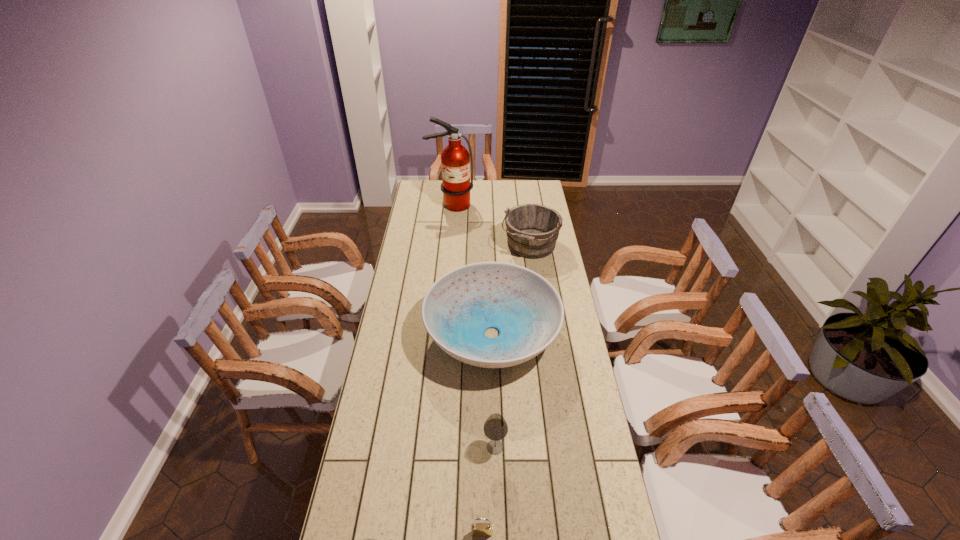
Identify the location of the third closest object to the nearest object. (524, 307).

Identify which object is located as the fourth nearest to the padlock. Please provide its 2D coordinates. Your answer should be formatted as a tuple, i.e. [(x, y)], where the tuple contains the x and y coordinates of a point satisfying the conditions above.

[(532, 230)]

The image size is (960, 540). I want to click on vacant space that satisfies the following two spatial constraints: 1. on the nozzle and handle of the second farthest object; 2. on the left side of the farthest object, so click(447, 246).

The width and height of the screenshot is (960, 540). Find the location of `vacant space that satisfies the following two spatial constraints: 1. on the nozzle and handle of the tallest object; 2. on the right side of the second farthest object`. vacant space that satisfies the following two spatial constraints: 1. on the nozzle and handle of the tallest object; 2. on the right side of the second farthest object is located at coordinates (447, 246).